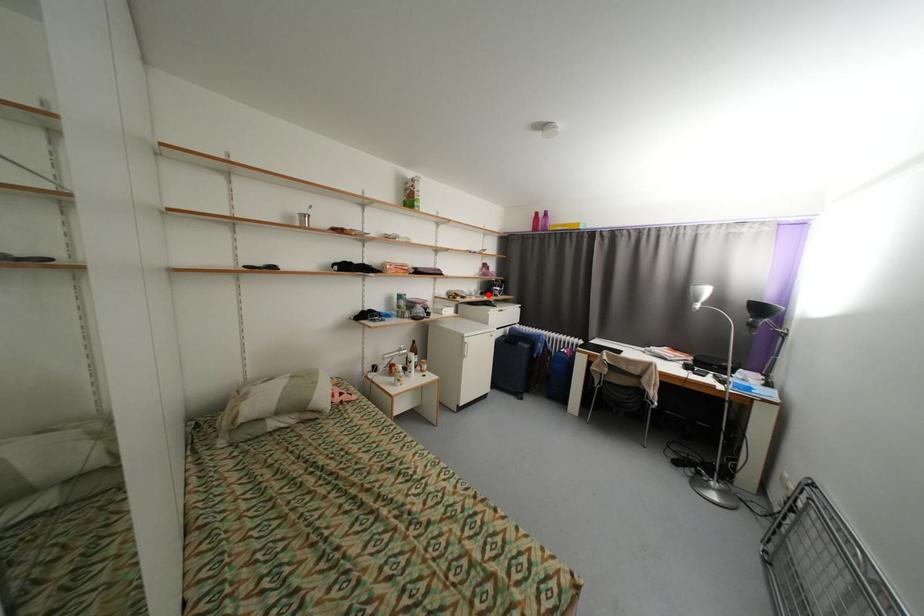
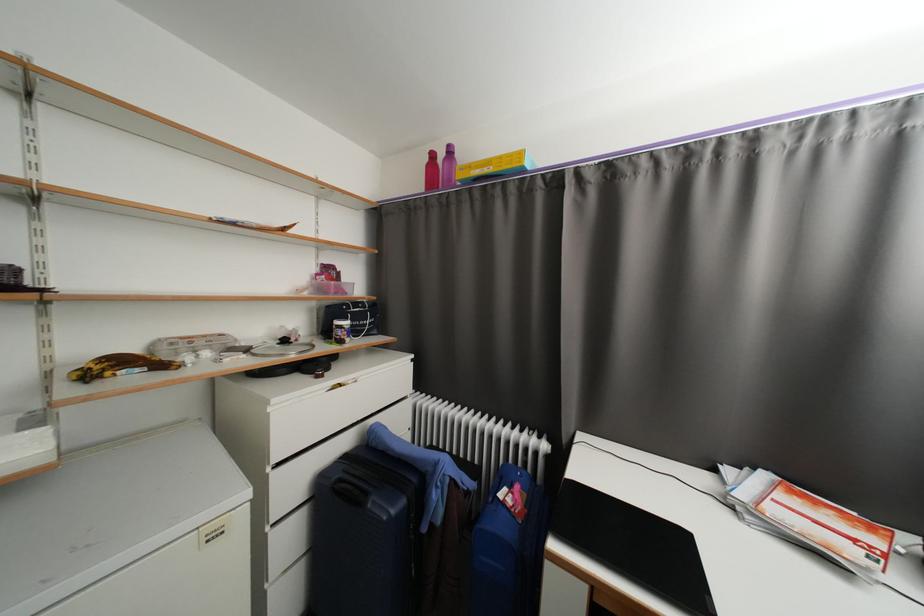
The point at the highlighted location is marked in the first image. Where is the corresponding point in the second image?

(290, 342)